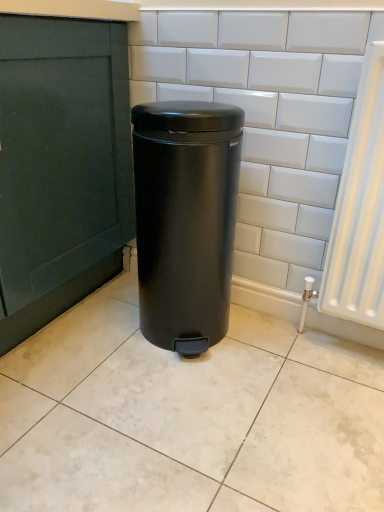
The height and width of the screenshot is (512, 384). Identify the location of free region on the left part of matte black trash can at center. (91, 328).